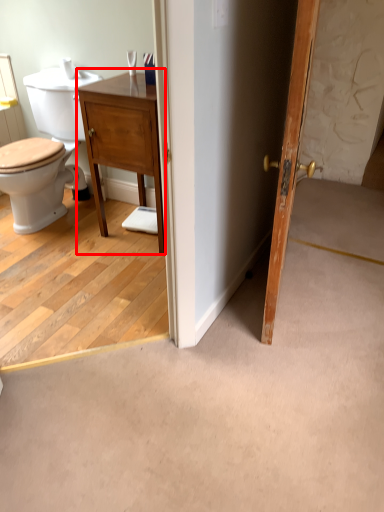
Question: In this image, where is vanity (annotated by the red box) located relative to door?

Choices:
 (A) left
 (B) right

Answer: (A)